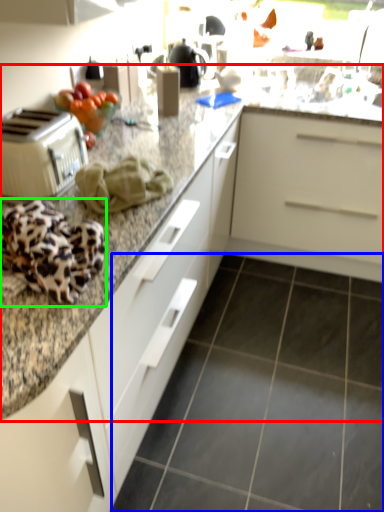
Question: Considering the real-world distances, which object is closest to countertop (highlighted by a red box)? granite (highlighted by a blue box) or blanket (highlighted by a green box).

Choices:
 (A) granite
 (B) blanket

Answer: (B)